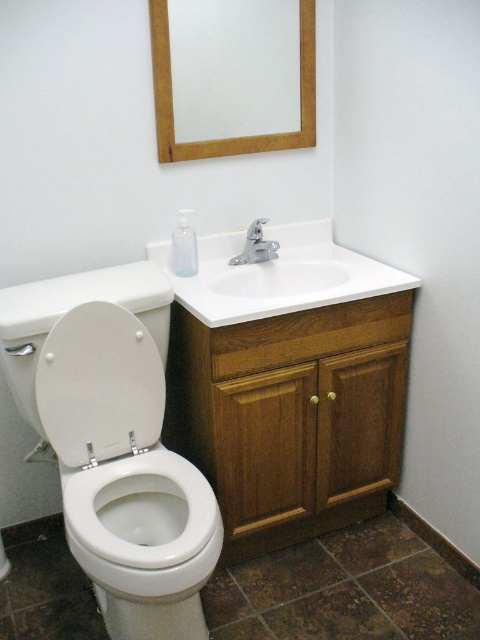
Which is more to the left, white glossy sink at center or wooden frame at upper center?

From the viewer's perspective, wooden frame at upper center appears more on the left side.

Can you confirm if white glossy sink at center is thinner than wooden frame at upper center?

No.

Is point (300, 288) less distant than point (301, 58)?

No.

At what (x,y) coordinates should I click in order to perform the action: click on white glossy sink at center. Please return your answer as a coordinate pair (x, y). Looking at the image, I should click on (276, 275).

Can you confirm if white glossy toilet at left is thinner than white matte toilet lid at left?

No, white glossy toilet at left is not thinner than white matte toilet lid at left.

Which is more to the right, white glossy toilet at left or white matte toilet lid at left?

Positioned to the right is white glossy toilet at left.

Is point (202, 566) closer to camera compared to point (123, 353)?

Yes, point (202, 566) is closer to viewer.

The image size is (480, 640). In order to click on white glossy toilet at left in this screenshot , I will do coord(115,442).

Can you confirm if white glossy toilet at left is positioned to the right of wooden frame at upper center?

No, white glossy toilet at left is not to the right of wooden frame at upper center.

Who is shorter, white glossy toilet at left or wooden frame at upper center?

Standing shorter between the two is wooden frame at upper center.

You are a GUI agent. You are given a task and a screenshot of the screen. Output one action in this format:
    pyautogui.click(x=<x>, y=<y>)
    Task: Click on the white glossy toilet at left
    This screenshot has height=640, width=480.
    Given the screenshot: What is the action you would take?
    pyautogui.click(x=115, y=442)

The width and height of the screenshot is (480, 640). Find the location of `white glossy toilet at left`. white glossy toilet at left is located at coordinates (115, 442).